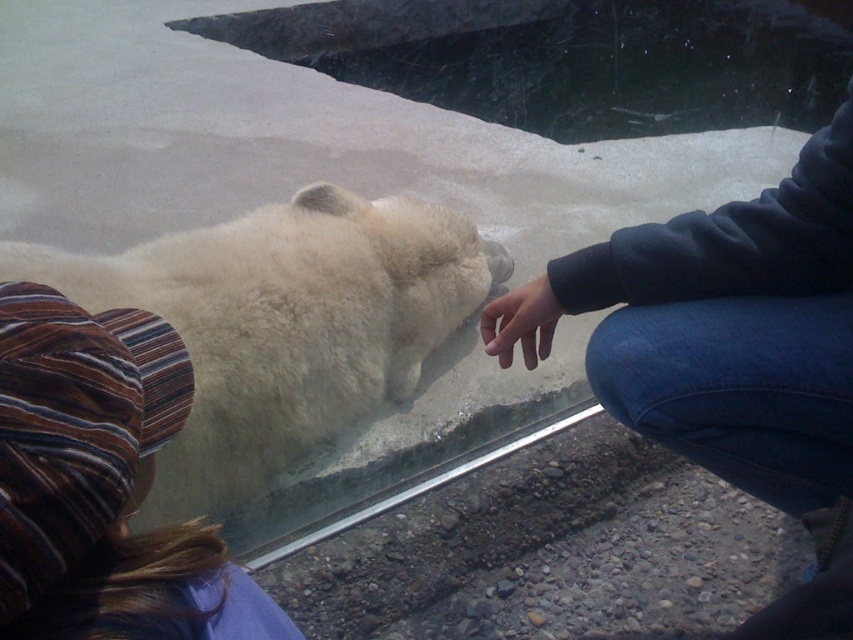
You are a zookeeper planning to place a new sign between the dark blue sweatshirt at upper right and the striped fabric hat at upper left. The sign must be positioned so that it is between them in height. Based on their heights, where should you place the sign vertically?

The dark blue sweatshirt at upper right is taller than the striped fabric hat at upper left. To place the sign between them vertically, position it so that it is lower than the dark blue sweatshirt at upper right but higher than the striped fabric hat at upper left.

You are standing in front of the polar bear enclosure and see two points marked on the glass barrier. The first point is at coordinate point(672, 449) and the second is at point(20, 513). Which point is closer to you?

Point(672, 449) is further to the camera than point(20, 513), so the point closer to you is point(20, 513).